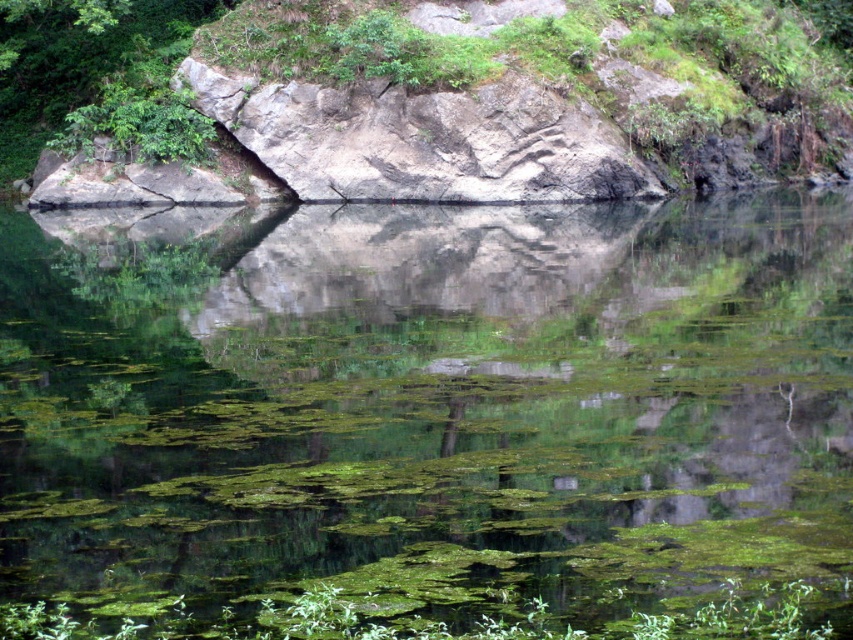
Can you confirm if green algae-covered water at center is taller than gray rock at center?

Incorrect, green algae-covered water at center's height is not larger of gray rock at center's.

Is point (715, 397) behind point (845, 92)?

No, (715, 397) is in front of (845, 92).

Who is more forward, (529,371) or (442,198)?

Point (529,371) is more forward.

Find the location of a particular element. This screenshot has width=853, height=640. green algae-covered water at center is located at coordinates point(430,419).